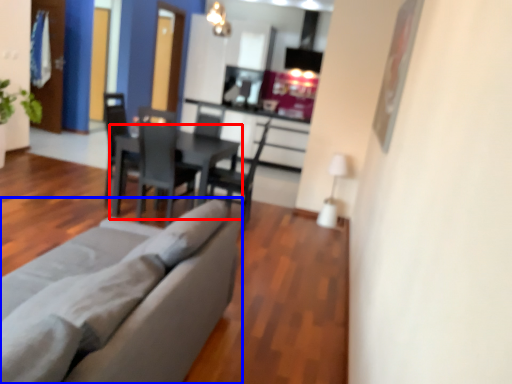
Question: Which object appears closest to the camera in this image, table (highlighted by a red box) or studio couch (highlighted by a blue box)?

Choices:
 (A) table
 (B) studio couch

Answer: (B)